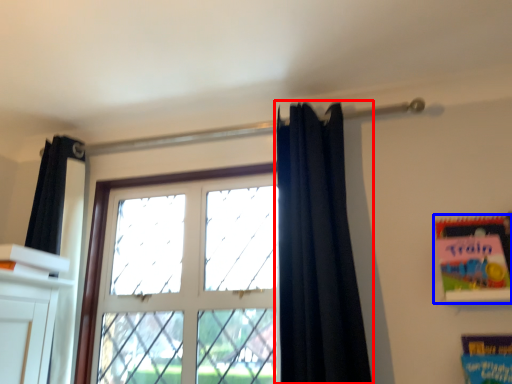
Question: Which object is further to the camera taking this photo, curtain (highlighted by a red box) or paperback book (highlighted by a blue box)?

Choices:
 (A) curtain
 (B) paperback book

Answer: (B)